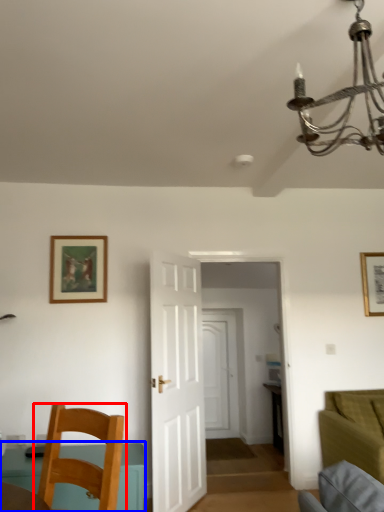
Question: Which object is further to the camera taking this photo, chair (highlighted by a red box) or table (highlighted by a blue box)?

Choices:
 (A) chair
 (B) table

Answer: (B)